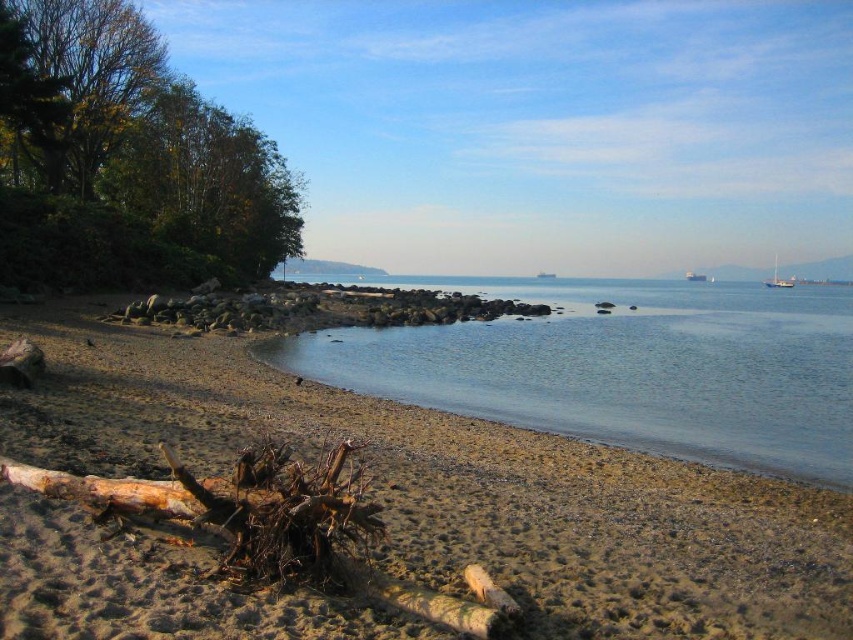
You are standing on the beach and want to reach the clear water at center. Based on the scene description, what direction should you move in to get there?

The clear water at center is located at point coordinates of 0.575 on the x axis and 0.733 on the y axis. Since you are on the beach, you need to move towards the water by walking forward towards the clear water at center.

You are planning to anchor a small boat that requires at least 10 meters of width to safely maneuver. Based on the scene, can the clear water at center provide enough space compared to the white glossy sailboat at upper right?

The clear water at center might be wider than the white glossy sailboat at upper right, so it could potentially provide sufficient width for anchoring the small boat safely.

You are a photographer planning to capture the entire coastal scene in one shot. Given that the brown sandy beach at lower left and the clear water at center are both in your viewfinder, which area should you focus on if you want to emphasize the larger portion of the scene?

The clear water at center is larger in size compared to the brown sandy beach at lower left, so focusing on the clear water at center would emphasize the larger portion of the scene.